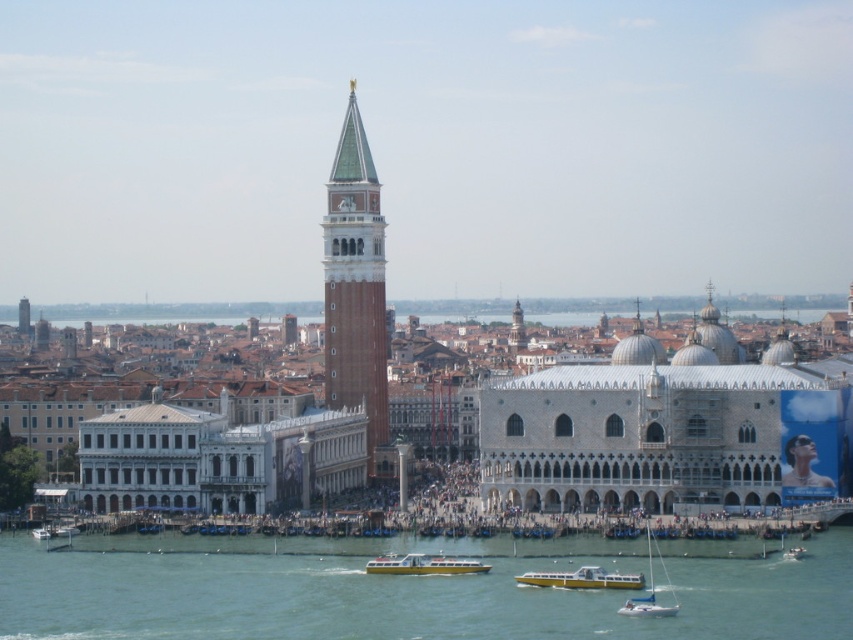
Is point (654, 592) positioned before point (788, 548)?

Yes, point (654, 592) is closer to viewer.

Is white plastic sailboat at lower right positioned behind white plastic boat at lower right?

No, it is not.

This screenshot has height=640, width=853. I want to click on white plastic sailboat at lower right, so click(648, 595).

This screenshot has width=853, height=640. What are the coordinates of `white plastic sailboat at lower right` in the screenshot? It's located at (648, 595).

How far apart are yellow matte boat at lower center and yellow plastic boat at center?

They are 140.22 feet apart.

In the scene shown: Does yellow matte boat at lower center appear over yellow plastic boat at center?

Yes, yellow matte boat at lower center is above yellow plastic boat at center.

Describe the element at coordinates (582, 579) in the screenshot. I see `yellow matte boat at lower center` at that location.

At what (x,y) coordinates should I click in order to perform the action: click on yellow matte boat at lower center. Please return your answer as a coordinate pair (x, y). The width and height of the screenshot is (853, 640). Looking at the image, I should click on (582, 579).

Is white plastic boat at center to the left of yellow plastic boat at center from the viewer's perspective?

No, white plastic boat at center is not to the left of yellow plastic boat at center.

Is white plastic boat at center positioned before yellow plastic boat at center?

Yes, white plastic boat at center is in front of yellow plastic boat at center.

Measure the distance between point (402,564) and camera.

They are 447.47 feet apart.

Where is `white plastic boat at center`? This screenshot has width=853, height=640. white plastic boat at center is located at coordinates (422, 564).